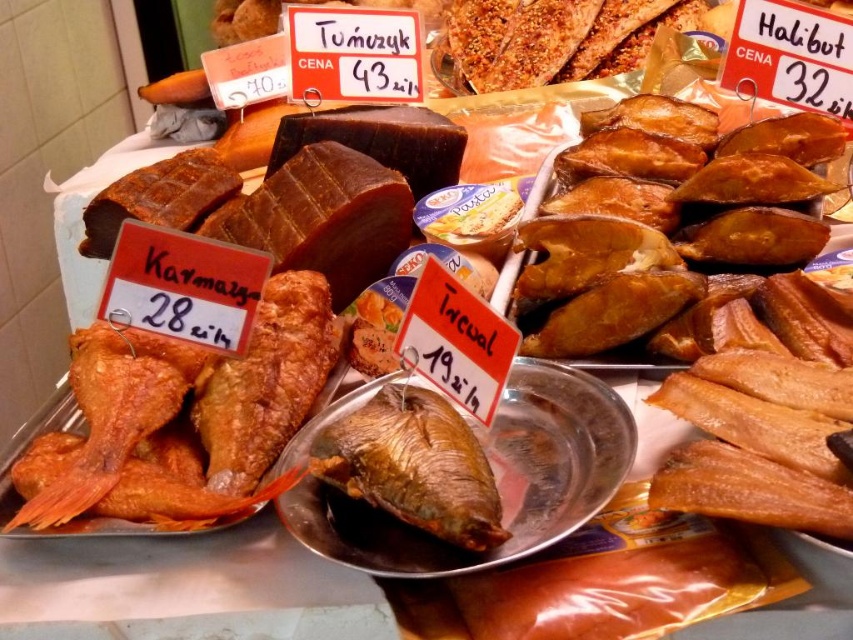
You are a customer at the market stall and want to buy both the golden brown dried fish at center and the brown matte fish at center. If you start from the left side of the stall, which fish should you pick up first?

The brown matte fish at center should be picked up first since it is located to the left of the golden brown dried fish at center.

You are a customer at the seafood market and want to buy a fish that is wider than the other. Which one should you choose between the brown smoked fish at right and the brown matte fish at center?

The brown smoked fish at right is wider than the brown matte fish at center, so you should choose the brown smoked fish at right.

You are a customer at the seafood market and want to buy both the brown smoked fish at right and the golden brown dried fish at center. If you start from the left side of the stall, which fish should you pick first and why?

You should pick the golden brown dried fish at center first because the brown smoked fish at right is located to the right of it, so you would encounter the golden brown dried fish at center first when moving from left to right.